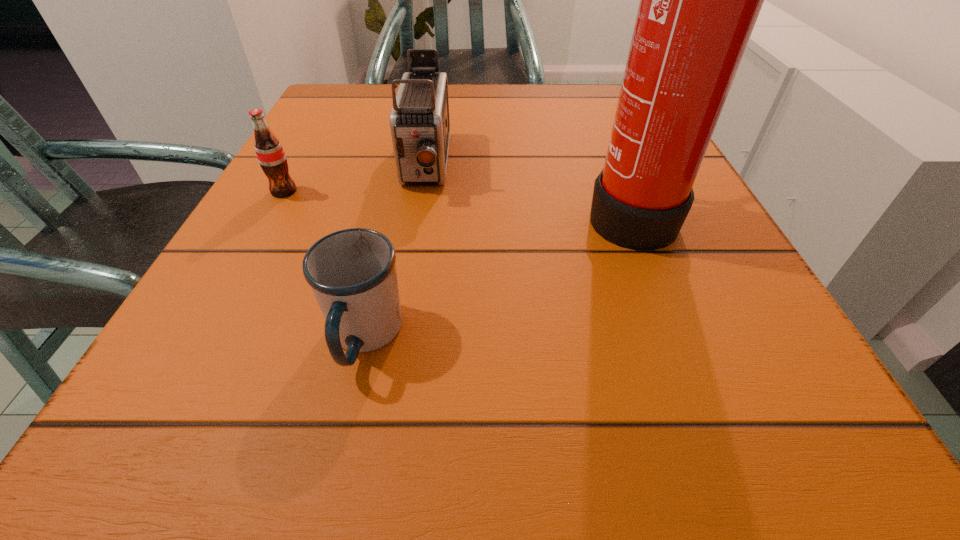
The width and height of the screenshot is (960, 540). Find the location of `object that stands as the third closest to the rightmost object`. object that stands as the third closest to the rightmost object is located at coordinates (270, 154).

Select which object appears as the third closest to the fire extinguisher. Please provide its 2D coordinates. Your answer should be formatted as a tuple, i.e. [(x, y)], where the tuple contains the x and y coordinates of a point satisfying the conditions above.

[(270, 154)]

Where is `vacant space that satisfies the following two spatial constraints: 1. on the front-facing side of the rightmost object; 2. on the handle side of the nearest object`? vacant space that satisfies the following two spatial constraints: 1. on the front-facing side of the rightmost object; 2. on the handle side of the nearest object is located at coordinates (679, 337).

The height and width of the screenshot is (540, 960). Identify the location of vacant point that satisfies the following two spatial constraints: 1. on the front-facing side of the tallest object; 2. on the handle side of the mug. (679, 337).

The image size is (960, 540). Find the location of `free space that satisfies the following two spatial constraints: 1. on the front-facing side of the fire extinguisher; 2. on the handle side of the mug`. free space that satisfies the following two spatial constraints: 1. on the front-facing side of the fire extinguisher; 2. on the handle side of the mug is located at coordinates (679, 337).